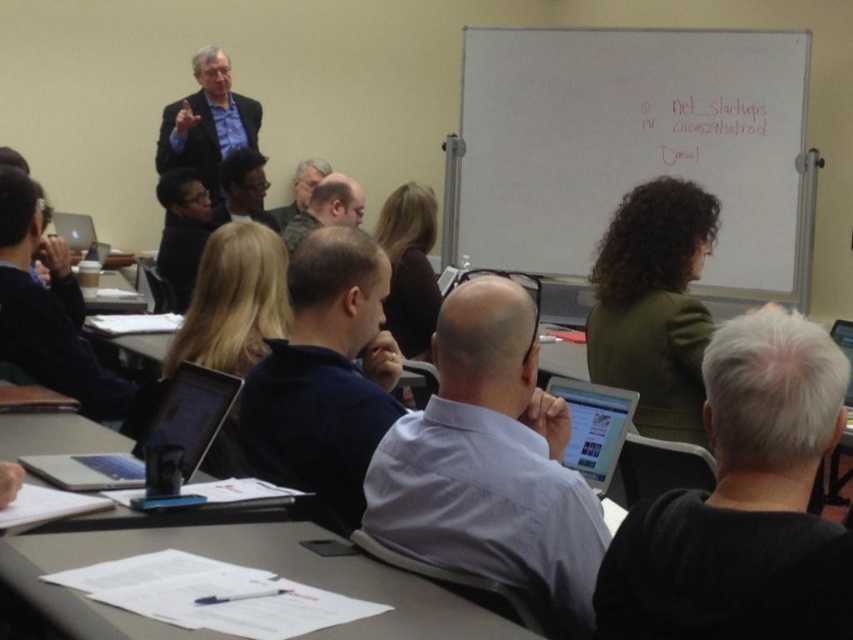
Who is more forward, (x=90, y=460) or (x=282, y=227)?

Point (x=90, y=460)

Between silver metallic laptop at lower left and gray hair at center, which one is positioned lower?

Positioned lower is silver metallic laptop at lower left.

Is point (90, 486) less distant than point (293, 198)?

Yes, point (90, 486) is in front of point (293, 198).

The width and height of the screenshot is (853, 640). Identify the location of silver metallic laptop at lower left. (151, 435).

Does white matte whiteboard at upper center appear over silver metallic laptop at lower left?

Yes.

Does white matte whiteboard at upper center appear on the left side of silver metallic laptop at lower left?

In fact, white matte whiteboard at upper center is to the right of silver metallic laptop at lower left.

Does point (676, 80) come behind point (221, 376)?

Yes, it is.

I want to click on white matte whiteboard at upper center, so click(631, 145).

Does silver metallic laptop at lower left have a lesser width compared to silver metallic laptop at center?

In fact, silver metallic laptop at lower left might be wider than silver metallic laptop at center.

Can you confirm if silver metallic laptop at lower left is smaller than silver metallic laptop at center?

No, silver metallic laptop at lower left is not smaller than silver metallic laptop at center.

You are a GUI agent. You are given a task and a screenshot of the screen. Output one action in this format:
    pyautogui.click(x=<x>, y=<y>)
    Task: Click on the silver metallic laptop at lower left
    The image size is (853, 640).
    Given the screenshot: What is the action you would take?
    pyautogui.click(x=151, y=435)

You are a GUI agent. You are given a task and a screenshot of the screen. Output one action in this format:
    pyautogui.click(x=<x>, y=<y>)
    Task: Click on the silver metallic laptop at lower left
    
    Given the screenshot: What is the action you would take?
    pyautogui.click(x=151, y=435)